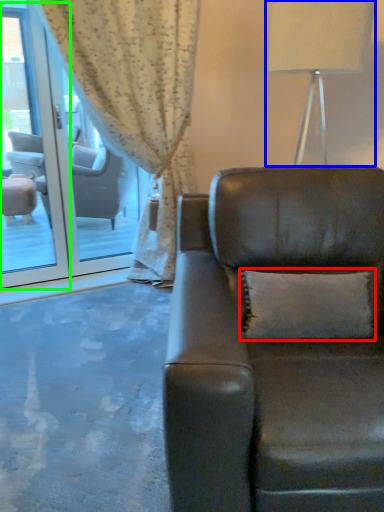
Question: Estimate the real-world distances between objects in this image. Which object is farther from pillow (highlighted by a red box), table lamp (highlighted by a blue box) or screen door (highlighted by a green box)?

Choices:
 (A) table lamp
 (B) screen door

Answer: (B)